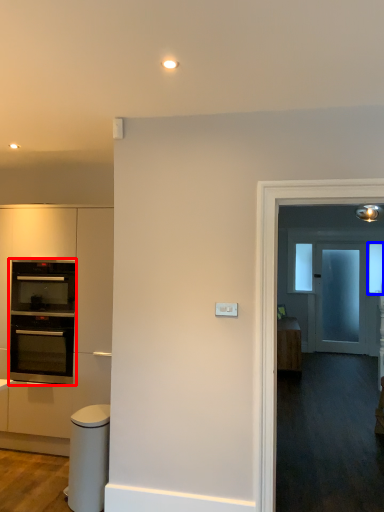
Question: Which object is further to the camera taking this photo, oven (highlighted by a red box) or window (highlighted by a blue box)?

Choices:
 (A) oven
 (B) window

Answer: (B)